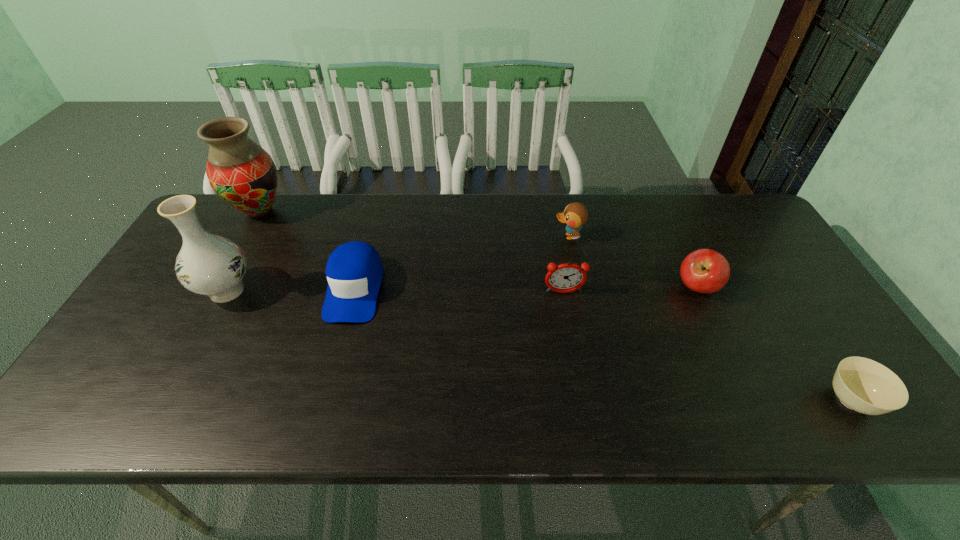
Identify which object is located as the fourth nearest to the duck. Please provide its 2D coordinates. Your answer should be formatted as a tuple, i.e. [(x, y)], where the tuple contains the x and y coordinates of a point satisfying the conditions above.

[(861, 384)]

Where is `vacant space that satisfies the following two spatial constraints: 1. on the front-facing side of the duck; 2. on the front-facing side of the alarm clock`? The image size is (960, 540). vacant space that satisfies the following two spatial constraints: 1. on the front-facing side of the duck; 2. on the front-facing side of the alarm clock is located at coordinates (581, 293).

Find the location of a particular element. Image resolution: width=960 pixels, height=540 pixels. free space in the image that satisfies the following two spatial constraints: 1. on the front-facing side of the duck; 2. on the front-facing side of the alarm clock is located at coordinates (581, 293).

This screenshot has width=960, height=540. I want to click on vacant space that satisfies the following two spatial constraints: 1. on the front-facing side of the duck; 2. on the left side of the shortest object, so click(604, 401).